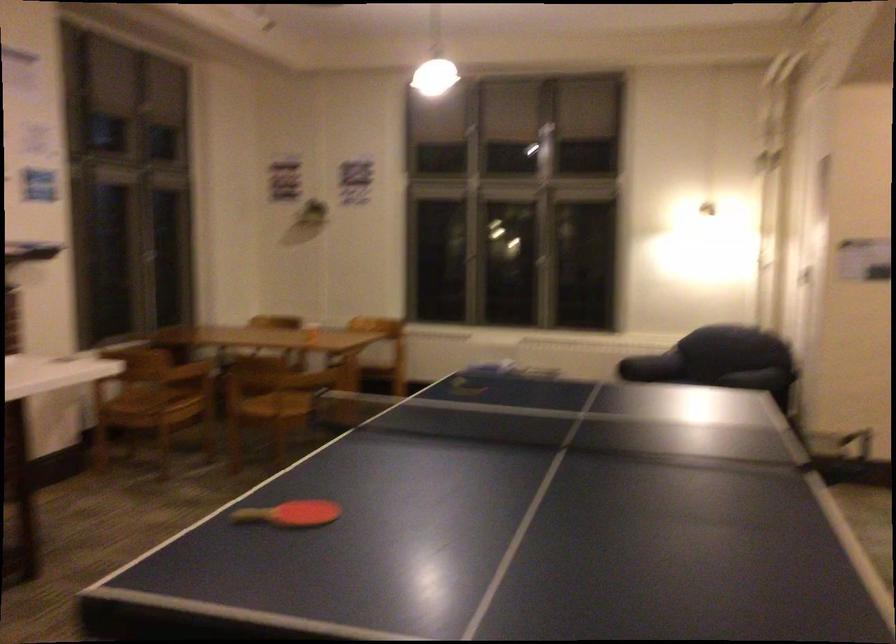
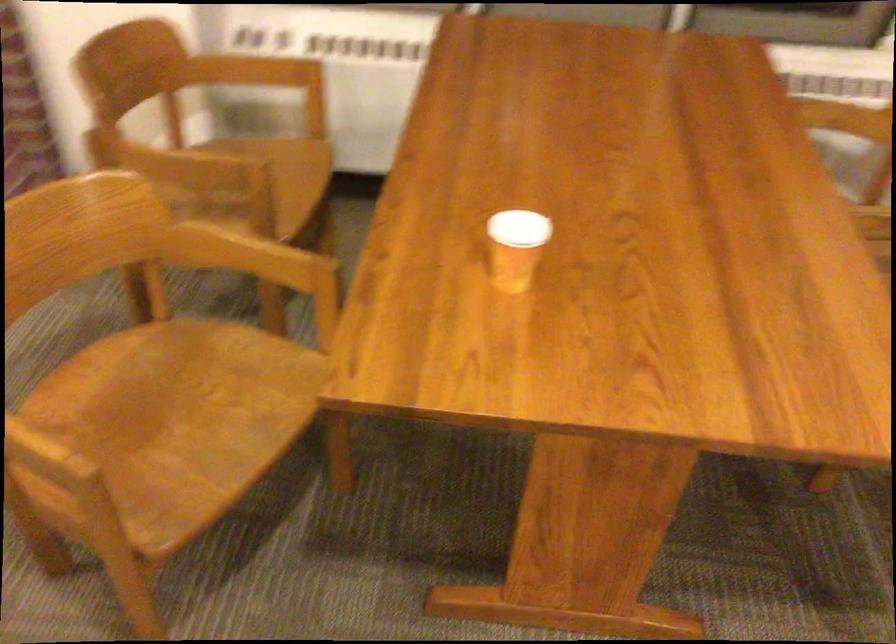
Locate, in the second image, the point that corresponds to point (296, 401) in the first image.

(170, 424)